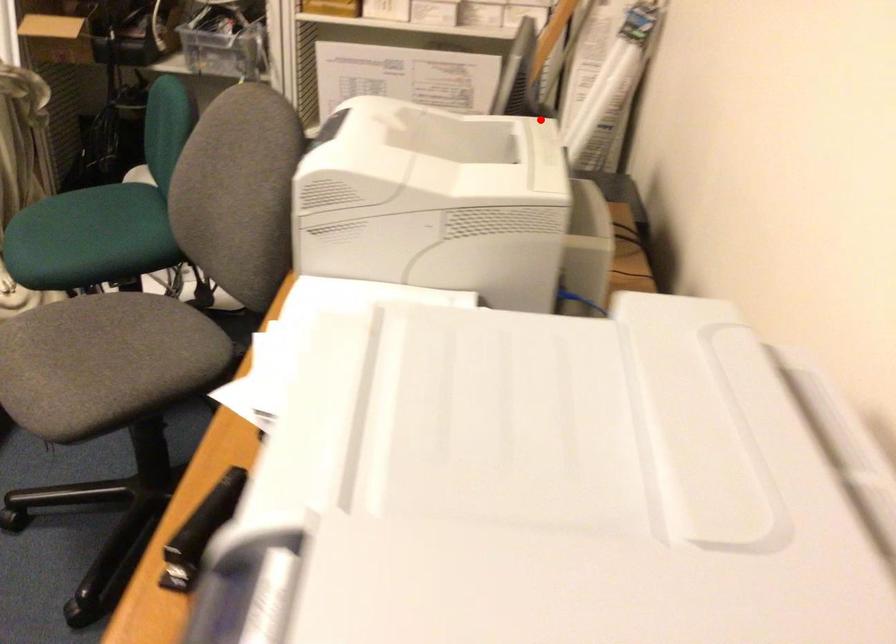
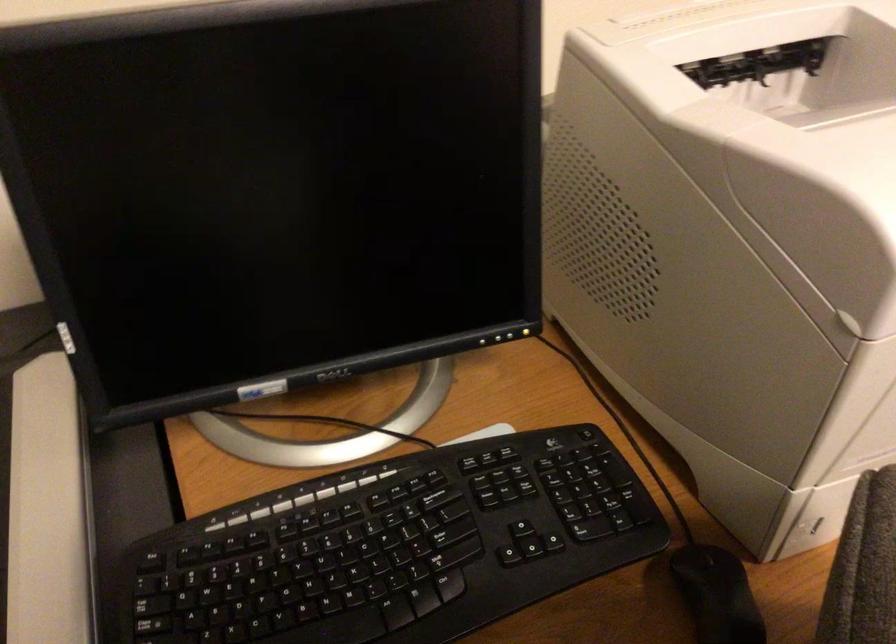
Question: I am providing you with two images of the same scene from different viewpoints. A red point is marked on the first image. Is the red point's position out of view in image 2?

Choices:
 (A) Yes
 (B) No

Answer: (B)